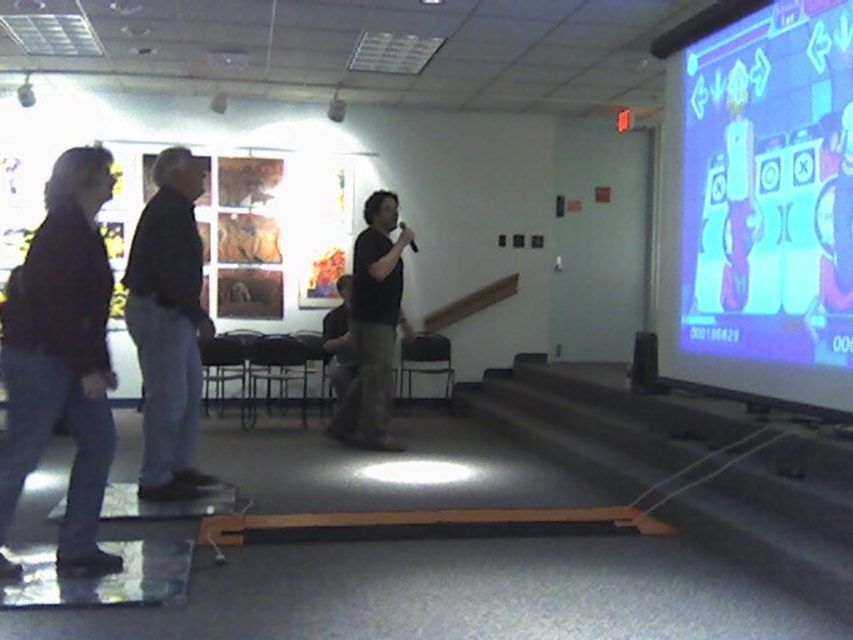
Question: Among these points, which one is nearest to the camera?

Choices:
 (A) (18, 292)
 (B) (688, 81)

Answer: (A)

Question: Does dark brown leather jacket at left come behind black matte shirt at center?

Choices:
 (A) yes
 (B) no

Answer: (B)

Question: Is matte blue screen at upper right above dark brown leather jacket at left?

Choices:
 (A) yes
 (B) no

Answer: (A)

Question: Which of the following is the farthest from the observer?

Choices:
 (A) (18, 385)
 (B) (670, 368)
 (C) (136, 294)

Answer: (B)

Question: Estimate the real-world distances between objects in this image. Which object is closer to the black matte shirt at center?

Choices:
 (A) matte blue screen at upper right
 (B) black cotton shirt at left
 (C) dark brown leather jacket at left

Answer: (B)

Question: Does dark brown leather jacket at left lie behind black cotton shirt at left?

Choices:
 (A) no
 (B) yes

Answer: (A)